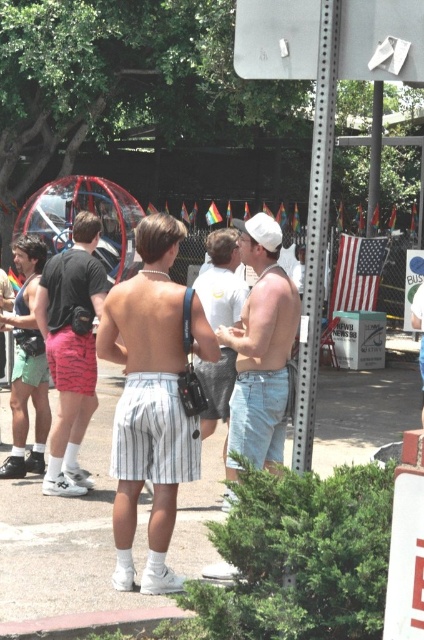
Is point (161, 273) farther from viewer compared to point (74, 481)?

No, it is not.

Is white striped shorts at center bigger than matte pink shorts at left?

Yes.

Locate an element on the screen. The width and height of the screenshot is (424, 640). white striped shorts at center is located at coordinates (148, 403).

From the picture: Is white striped shorts at center wider than white cotton shirt at center?

Yes, white striped shorts at center is wider than white cotton shirt at center.

Can you confirm if white striped shorts at center is bigger than white cotton shirt at center?

Indeed, white striped shorts at center has a larger size compared to white cotton shirt at center.

Describe the element at coordinates (148, 403) in the screenshot. I see `white striped shorts at center` at that location.

Locate an element on the screen. This screenshot has height=640, width=424. white striped shorts at center is located at coordinates (148, 403).

Identify the location of white striped shorts at center. The image size is (424, 640). (148, 403).

Who is taller, white striped shorts at center or matte white shorts at center?

white striped shorts at center is taller.

Find the location of a particular element. The image size is (424, 640). white striped shorts at center is located at coordinates (148, 403).